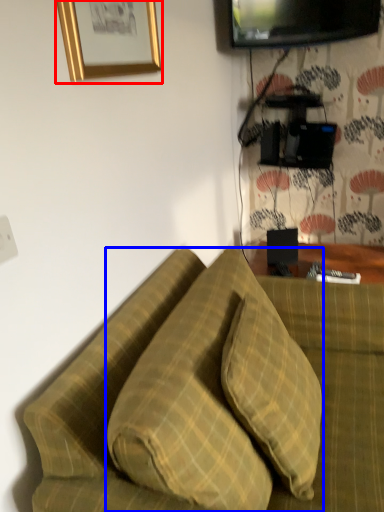
Question: Among these objects, which one is nearest to the camera, picture frame (highlighted by a red box) or pillow (highlighted by a blue box)?

Choices:
 (A) picture frame
 (B) pillow

Answer: (B)